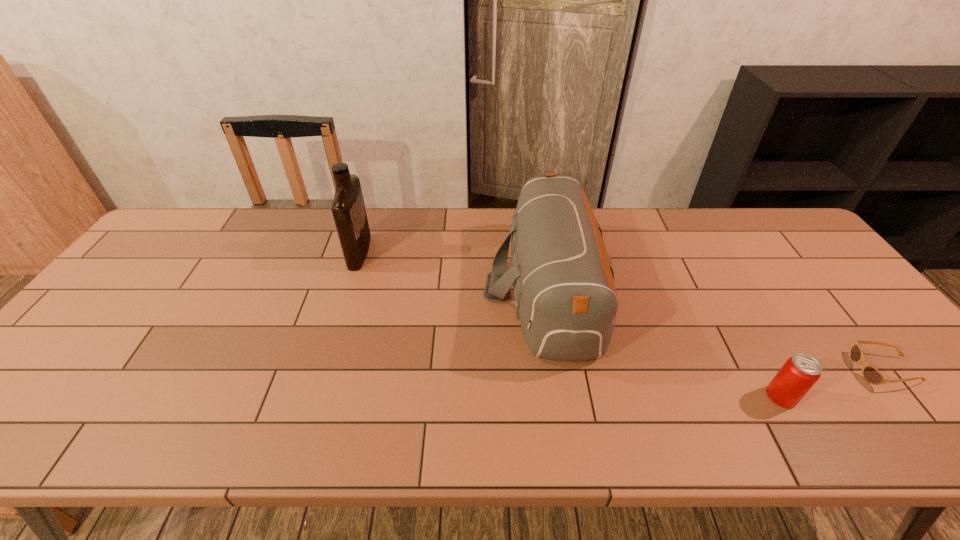
This screenshot has height=540, width=960. I want to click on object that stands as the second closest to the second object from left to right, so click(348, 208).

Locate an element on the screen. object that is the closest to the liquor is located at coordinates (565, 298).

Locate an element on the screen. This screenshot has width=960, height=540. blank space that satisfies the following two spatial constraints: 1. on the front side of the second object from left to right; 2. on the left side of the can is located at coordinates (563, 396).

Identify the location of free spot that satisfies the following two spatial constraints: 1. on the label side of the tallest object; 2. on the left side of the third object from right to left. Image resolution: width=960 pixels, height=540 pixels. (348, 288).

Locate an element on the screen. free space that satisfies the following two spatial constraints: 1. on the label side of the second object from right to left; 2. on the left side of the tallest object is located at coordinates (315, 396).

I want to click on vacant area that satisfies the following two spatial constraints: 1. on the label side of the leftmost object; 2. on the right side of the can, so click(315, 396).

Image resolution: width=960 pixels, height=540 pixels. Find the location of `vacant area in the image that satisfies the following two spatial constraints: 1. on the label side of the leftmost object; 2. on the left side of the third tallest object`. vacant area in the image that satisfies the following two spatial constraints: 1. on the label side of the leftmost object; 2. on the left side of the third tallest object is located at coordinates (315, 396).

Find the location of `blank area in the image that satisfies the following two spatial constraints: 1. on the label side of the leftmost object; 2. on the back side of the can`. blank area in the image that satisfies the following two spatial constraints: 1. on the label side of the leftmost object; 2. on the back side of the can is located at coordinates (315, 396).

The width and height of the screenshot is (960, 540). I want to click on free location that satisfies the following two spatial constraints: 1. on the label side of the tallest object; 2. on the right side of the can, so click(315, 396).